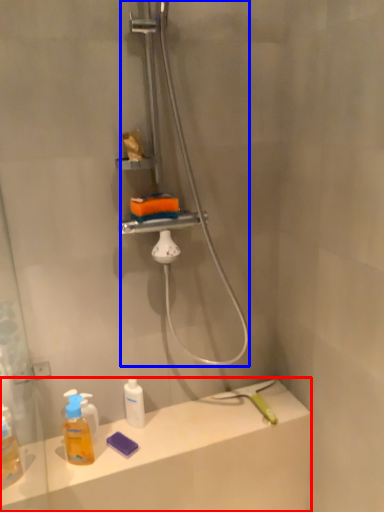
Question: Which of the following is the farthest to the observer, counter top (highlighted by a red box) or shower (highlighted by a blue box)?

Choices:
 (A) counter top
 (B) shower

Answer: (A)